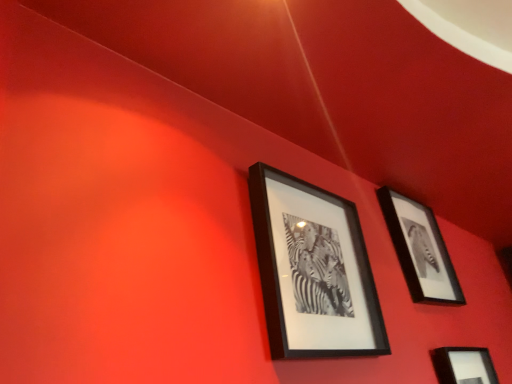
Question: Is black matte picture frame at upper right, which is counted as the second picture frame, starting from the left, to the left of black matte picture frame at lower right, arranged as the first picture frame when viewed from the right, from the viewer's perspective?

Choices:
 (A) no
 (B) yes

Answer: (B)

Question: Is black matte picture frame at lower right, placed as the 3th picture frame when sorted from left to right, at the back of black matte picture frame at upper right, which is counted as the second picture frame, starting from the left?

Choices:
 (A) yes
 (B) no

Answer: (B)

Question: Considering the relative sizes of black matte picture frame at upper right, marked as the second picture frame in a right-to-left arrangement, and black matte picture frame at lower right, arranged as the first picture frame when viewed from the right, in the image provided, is black matte picture frame at upper right, marked as the second picture frame in a right-to-left arrangement, thinner than black matte picture frame at lower right, arranged as the first picture frame when viewed from the right,?

Choices:
 (A) yes
 (B) no

Answer: (A)

Question: From a real-world perspective, is black matte picture frame at upper right, marked as the second picture frame in a right-to-left arrangement, located higher than black matte picture frame at lower right, arranged as the first picture frame when viewed from the right?

Choices:
 (A) no
 (B) yes

Answer: (B)

Question: Is black matte picture frame at upper right, marked as the second picture frame in a right-to-left arrangement, placed right next to black matte picture frame at lower right, arranged as the first picture frame when viewed from the right?

Choices:
 (A) yes
 (B) no

Answer: (B)

Question: Is black matte picture frame at upper right, marked as the second picture frame in a right-to-left arrangement, behind black matte picture frame at lower right, arranged as the first picture frame when viewed from the right?

Choices:
 (A) no
 (B) yes

Answer: (B)

Question: Is black matte picture frame at upper center, placed as the first picture frame when sorted from left to right, to the left of black matte picture frame at upper right, marked as the second picture frame in a right-to-left arrangement, from the viewer's perspective?

Choices:
 (A) no
 (B) yes

Answer: (B)

Question: Does black matte picture frame at upper center, placed as the first picture frame when sorted from left to right, have a greater width compared to black matte picture frame at upper right, which is counted as the second picture frame, starting from the left?

Choices:
 (A) yes
 (B) no

Answer: (A)

Question: Considering the relative positions of black matte picture frame at upper center, marked as the 3th picture frame in a right-to-left arrangement, and black matte picture frame at upper right, marked as the second picture frame in a right-to-left arrangement, in the image provided, is black matte picture frame at upper center, marked as the 3th picture frame in a right-to-left arrangement, in front of black matte picture frame at upper right, marked as the second picture frame in a right-to-left arrangement,?

Choices:
 (A) no
 (B) yes

Answer: (B)

Question: Is black matte picture frame at upper right, marked as the second picture frame in a right-to-left arrangement, located within black matte picture frame at upper center, placed as the first picture frame when sorted from left to right?

Choices:
 (A) no
 (B) yes

Answer: (A)

Question: Does black matte picture frame at upper center, marked as the 3th picture frame in a right-to-left arrangement, have a lesser width compared to black matte picture frame at upper right, which is counted as the second picture frame, starting from the left?

Choices:
 (A) yes
 (B) no

Answer: (B)

Question: From the image's perspective, is black matte picture frame at upper center, marked as the 3th picture frame in a right-to-left arrangement, located above black matte picture frame at upper right, which is counted as the second picture frame, starting from the left?

Choices:
 (A) no
 (B) yes

Answer: (B)

Question: Is black matte picture frame at upper center, placed as the first picture frame when sorted from left to right, next to black matte picture frame at lower right, arranged as the first picture frame when viewed from the right, and touching it?

Choices:
 (A) yes
 (B) no

Answer: (B)